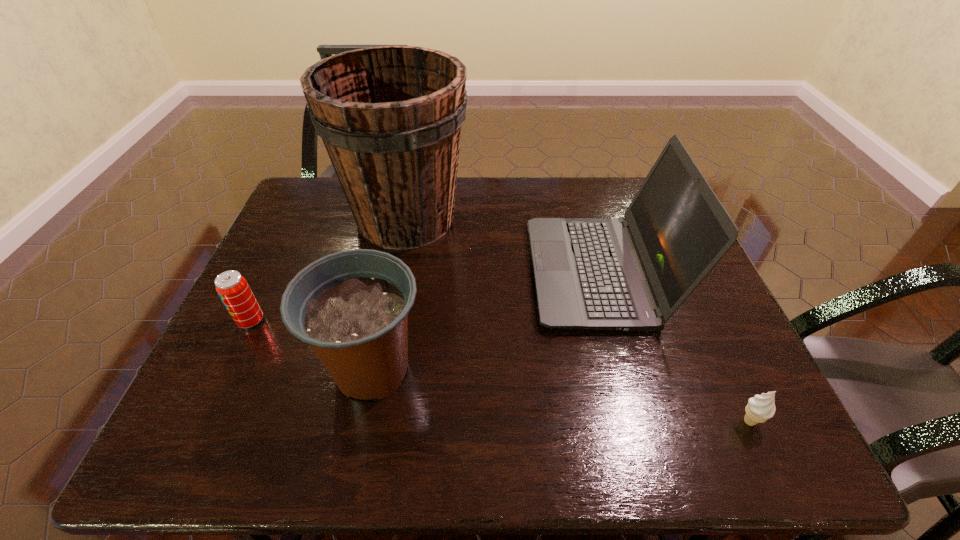
This screenshot has width=960, height=540. I want to click on vacant point located on the screen of the second object from right to left, so click(x=510, y=273).

Identify the location of vacant region located 0.080m on the screen of the second object from right to left. Image resolution: width=960 pixels, height=540 pixels. (502, 273).

Where is `vacant region located 0.050m on the right of the third shortest object`? Image resolution: width=960 pixels, height=540 pixels. vacant region located 0.050m on the right of the third shortest object is located at coordinates (450, 369).

Image resolution: width=960 pixels, height=540 pixels. What are the coordinates of `vacant space located on the back of the soda can` in the screenshot? It's located at (298, 221).

Locate an element on the screen. The image size is (960, 540). object present at the far edge is located at coordinates (390, 117).

The height and width of the screenshot is (540, 960). Find the location of `flowerpot situated at the near edge`. flowerpot situated at the near edge is located at coordinates (352, 307).

Identify the location of icecream located at the near edge. This screenshot has width=960, height=540. (760, 408).

Find the location of a particular element. object at the left edge is located at coordinates (233, 289).

Locate an element on the screen. laptop_computer that is at the right edge is located at coordinates (631, 273).

Where is `icecream present at the right edge`? icecream present at the right edge is located at coordinates (760, 408).